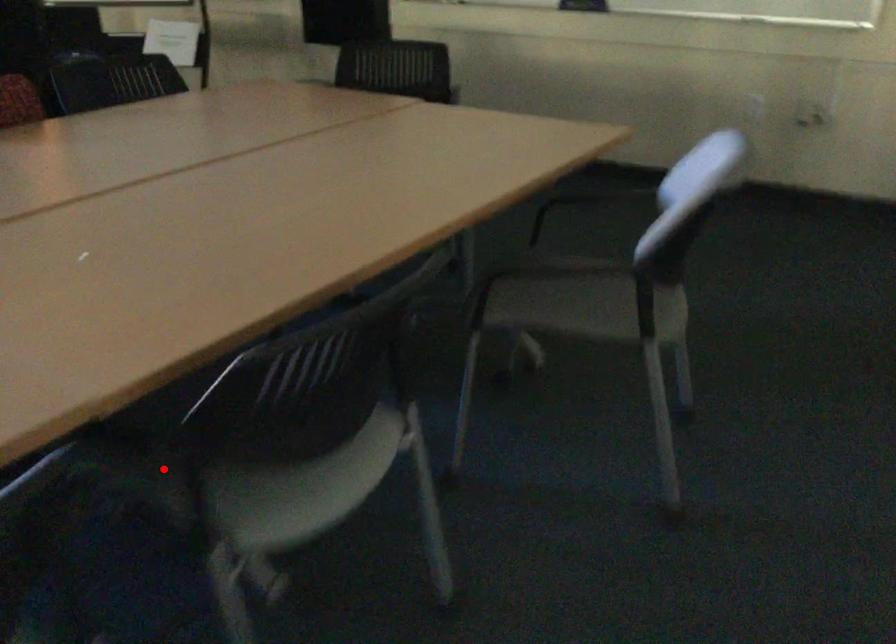
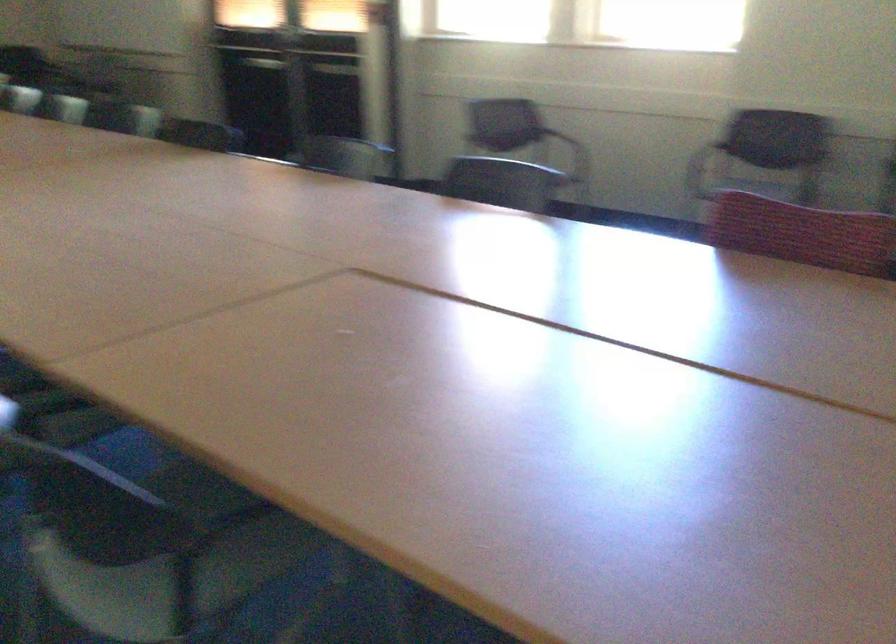
Find the pixel in the second image that matches the highlighted location in the first image.

(170, 467)